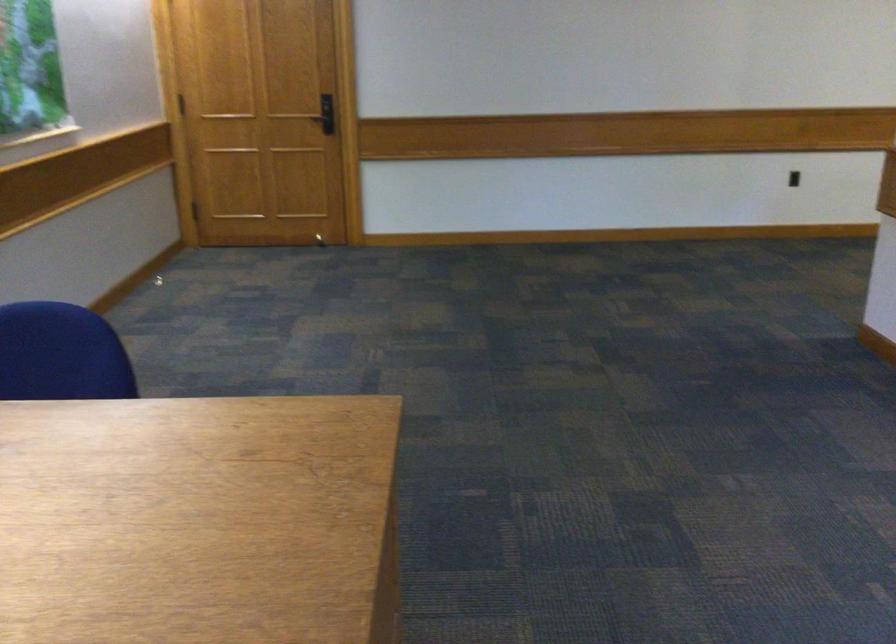
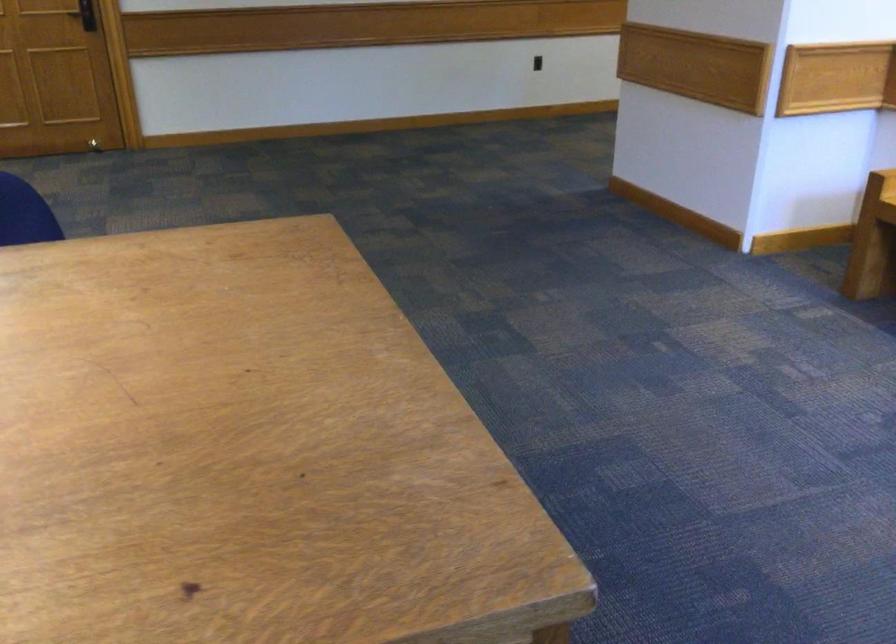
Where in the second image is the point corresponding to point (656, 355) from the first image?

(515, 214)